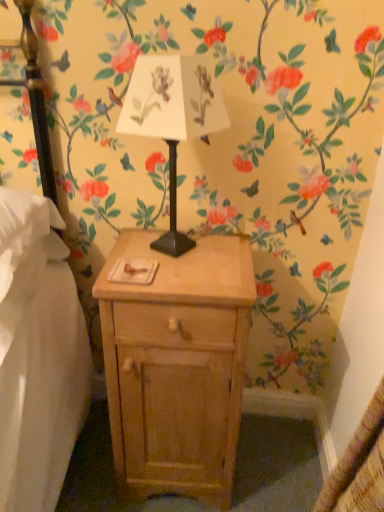
Question: Choose the correct answer: Is white paper lampshade at center inside light wood nightstand at center or outside it?

Choices:
 (A) inside
 (B) outside

Answer: (B)

Question: From a real-world perspective, is white paper lampshade at center above or below light wood nightstand at center?

Choices:
 (A) below
 (B) above

Answer: (B)

Question: Visually, is white paper lampshade at center positioned to the left or to the right of light wood nightstand at center?

Choices:
 (A) right
 (B) left

Answer: (B)

Question: In terms of width, does light wood nightstand at center look wider or thinner when compared to white paper lampshade at center?

Choices:
 (A) wide
 (B) thin

Answer: (A)

Question: In terms of size, does light wood nightstand at center appear bigger or smaller than white paper lampshade at center?

Choices:
 (A) big
 (B) small

Answer: (A)

Question: In terms of height, does light wood nightstand at center look taller or shorter compared to white paper lampshade at center?

Choices:
 (A) tall
 (B) short

Answer: (A)

Question: Is light wood nightstand at center inside the boundaries of white paper lampshade at center, or outside?

Choices:
 (A) outside
 (B) inside

Answer: (A)